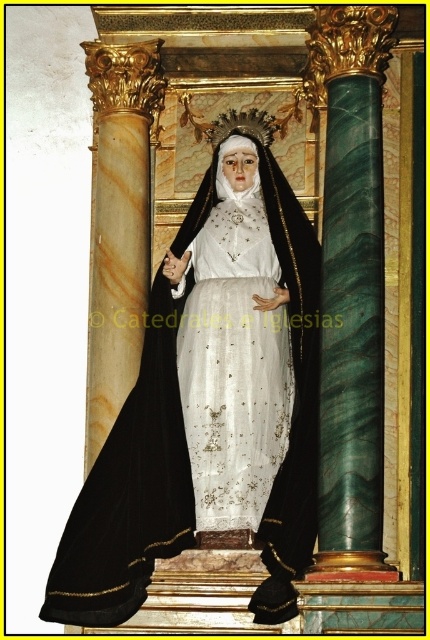
Question: Does black velvet cloak at center appear under white satin dress at center?

Choices:
 (A) yes
 (B) no

Answer: (A)

Question: Where is black velvet cloak at center located in relation to white satin dress at center in the image?

Choices:
 (A) right
 (B) left

Answer: (B)

Question: Which point is closer to the camera?

Choices:
 (A) (200, 349)
 (B) (236, 205)

Answer: (A)

Question: Does black velvet cloak at center appear over white satin dress at center?

Choices:
 (A) yes
 (B) no

Answer: (B)